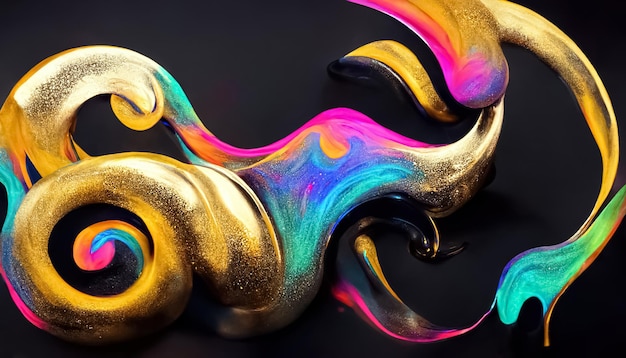
Where is `yellow paint`? yellow paint is located at coordinates (606, 126), (401, 60), (74, 294), (144, 122).